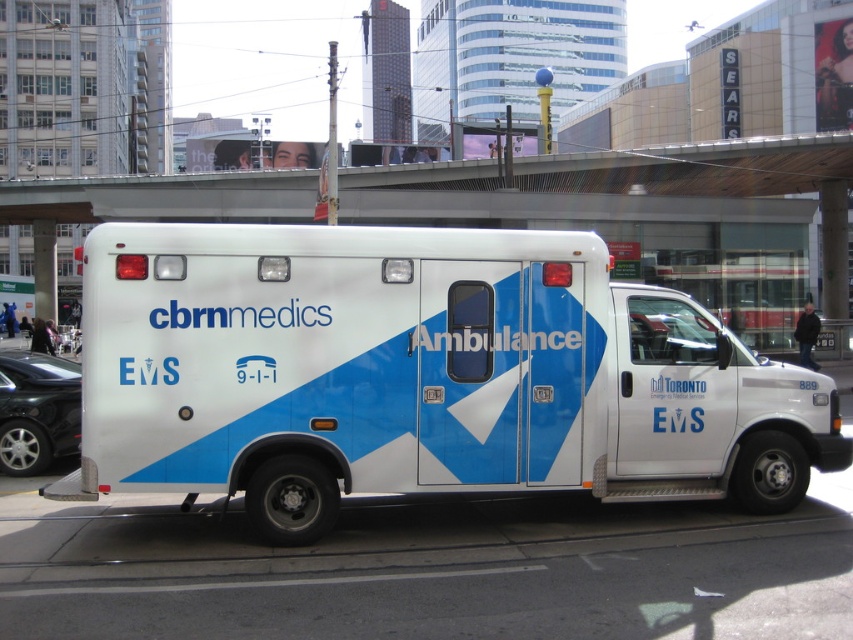
You are a city planner analyzing traffic patterns. You need to place a new traffic light at the intersection closest to the white glossy ambulance at center. Based on the ambulance location coordinates, which intersection quadrant should the traffic light be placed in?

The white glossy ambulance at center is located at coordinates point (421,374). Since the x and y coordinates are both above 0.5, the ambulance is in the northeast quadrant of the image. Therefore, the traffic light should be placed at the northeast intersection quadrant.

You are a city planner assessing the width of the white glossy ambulance at center and the concrete bridge at upper center. Which object has a smaller width?

The white glossy ambulance at center has a smaller width than the concrete bridge at upper center.